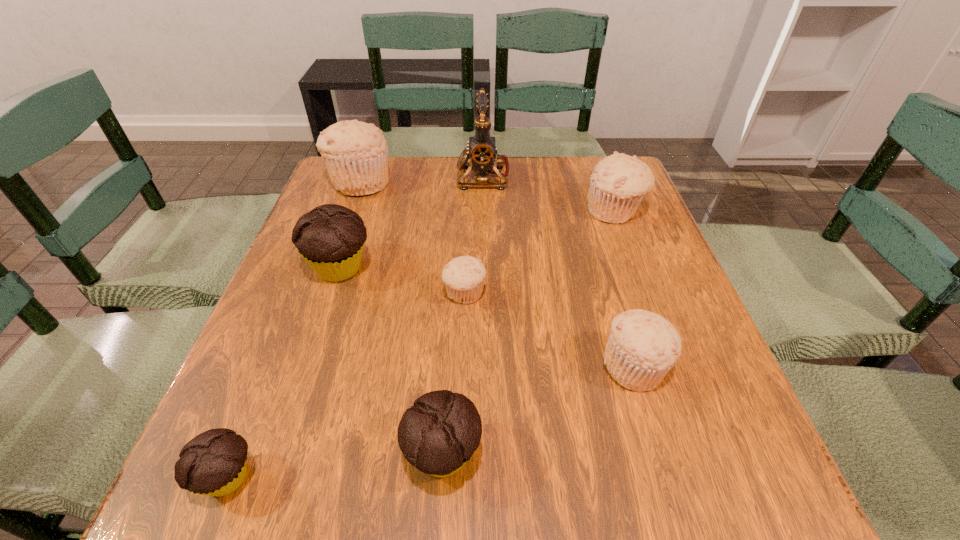
In the image, there is a desktop. At what (x,y) coordinates should I click in order to perform the action: click on vacant space at the near left corner. Please return your answer as a coordinate pair (x, y). Looking at the image, I should click on (276, 512).

Where is `vacant space at the near right corner of the desktop`? The width and height of the screenshot is (960, 540). vacant space at the near right corner of the desktop is located at coordinates (678, 463).

In order to click on empty space that is in between the rightmost chocolate muffin and the leftmost beige muffin in this screenshot , I will do `click(402, 319)`.

Find the location of a particular element. blank region between the black telephone and the second biggest beige muffin is located at coordinates (549, 193).

Find the location of a particular element. This screenshot has width=960, height=540. vacant space that is in between the second smallest chocolate muffin and the third beige muffin from right to left is located at coordinates (454, 374).

At what (x,y) coordinates should I click in order to perform the action: click on empty space between the nearest beige muffin and the tallest object. Please return your answer as a coordinate pair (x, y). This screenshot has width=960, height=540. Looking at the image, I should click on (559, 271).

Where is `free space that is in between the seventh shortest object and the third biggest beige muffin`? Image resolution: width=960 pixels, height=540 pixels. free space that is in between the seventh shortest object and the third biggest beige muffin is located at coordinates tap(498, 274).

The width and height of the screenshot is (960, 540). Find the location of `vacant area that lies between the farthest chocolate muffin and the black telephone`. vacant area that lies between the farthest chocolate muffin and the black telephone is located at coordinates (412, 222).

At what (x,y) coordinates should I click in order to perform the action: click on empty space between the third biggest beige muffin and the tallest muffin. Please return your answer as a coordinate pair (x, y). The image size is (960, 540). Looking at the image, I should click on (498, 274).

Find the location of `object that is the seventh closest one to the third beige muffin from right to left`. object that is the seventh closest one to the third beige muffin from right to left is located at coordinates (213, 463).